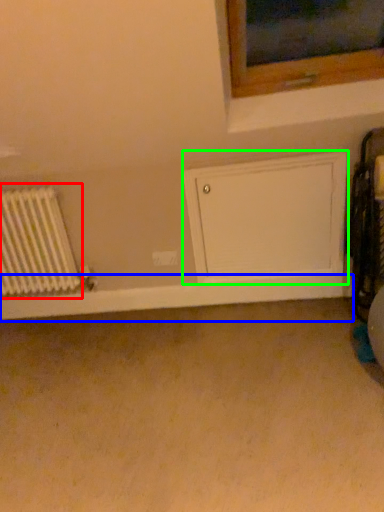
Question: Based on their relative distances, which object is farther from radiator (highlighted by a red box)? Choose from window sill (highlighted by a blue box) and wide (highlighted by a green box).

Choices:
 (A) window sill
 (B) wide

Answer: (B)